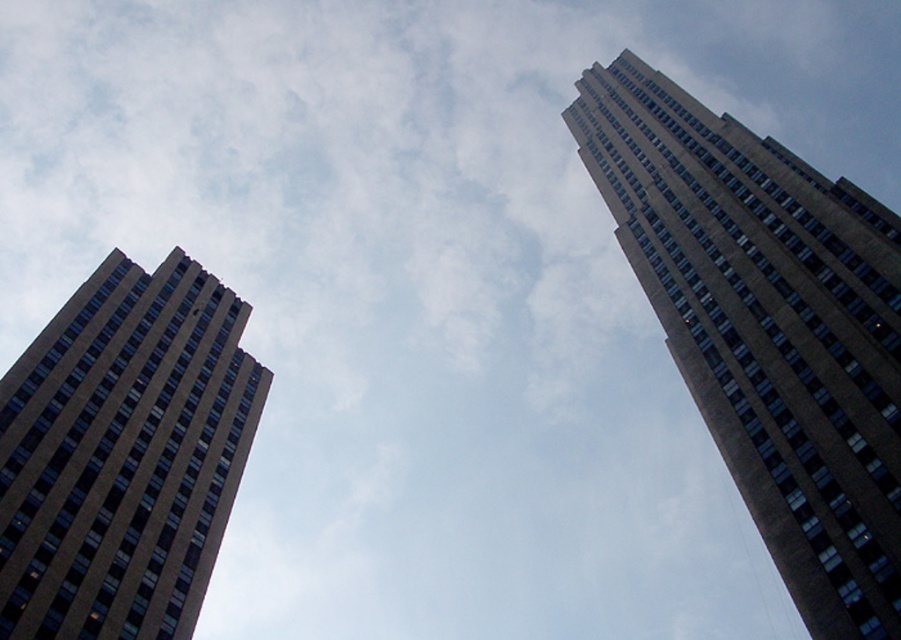
Can you confirm if brown concrete building at right is wider than brown concrete building at left?

Yes.

What do you see at coordinates (765, 332) in the screenshot?
I see `brown concrete building at right` at bounding box center [765, 332].

The image size is (901, 640). In order to click on brown concrete building at right in this screenshot , I will do `click(765, 332)`.